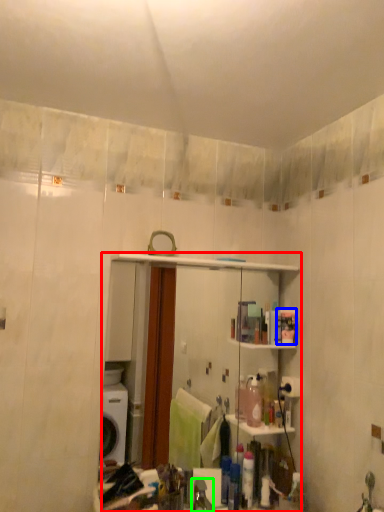
Question: Which object is positioned farthest from mirror (highlighted by a red box)? Select from toiletry (highlighted by a blue box) and faucet (highlighted by a green box).

Choices:
 (A) toiletry
 (B) faucet

Answer: (B)